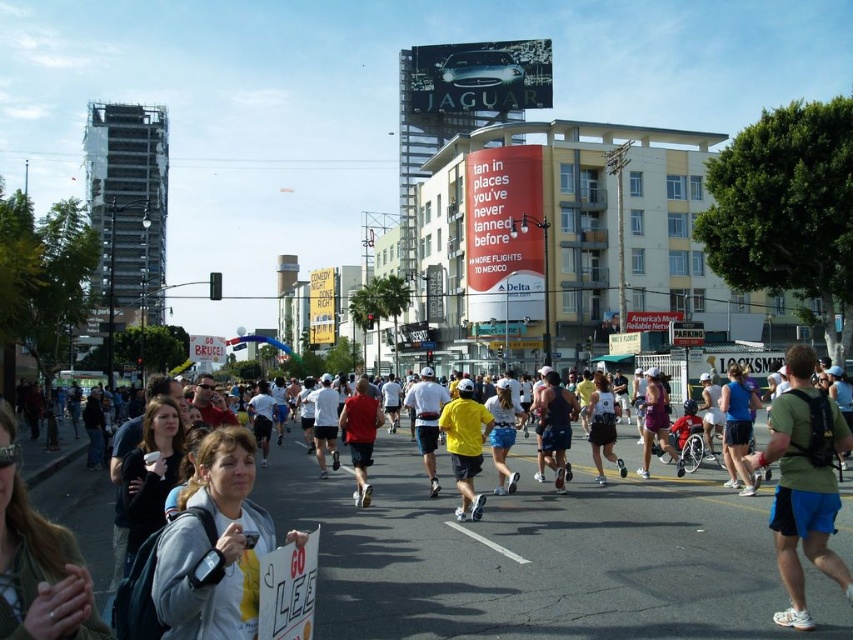
What is the exact coordinate of the red matte shirt at center in the image?

The red matte shirt at center is located at point (360,435).

In the marathon scene, there are two participants wearing a red matte shirt at center and a white matte tank top at center. Which clothing item is bigger in size?

The red matte shirt at center is larger in size compared to the white matte tank top at center.